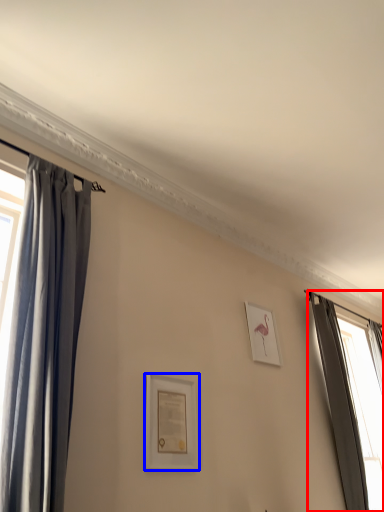
Question: Among these objects, which one is farthest to the camera, curtain (highlighted by a red box) or picture frame (highlighted by a blue box)?

Choices:
 (A) curtain
 (B) picture frame

Answer: (A)